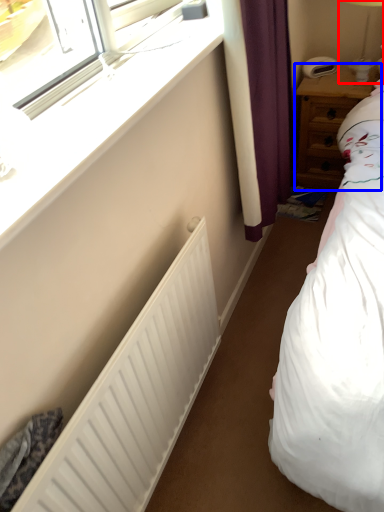
Question: Which object is further to the camera taking this photo, bedside lamp (highlighted by a red box) or nightstand (highlighted by a blue box)?

Choices:
 (A) bedside lamp
 (B) nightstand

Answer: (B)